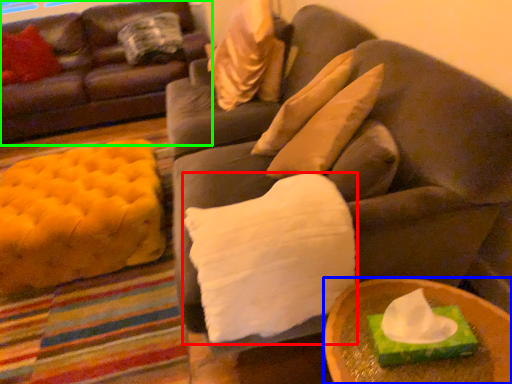
Question: Which object is positioned closest to pillow (highlighted by a red box)? Select from table (highlighted by a blue box) and studio couch (highlighted by a green box).

Choices:
 (A) table
 (B) studio couch

Answer: (A)